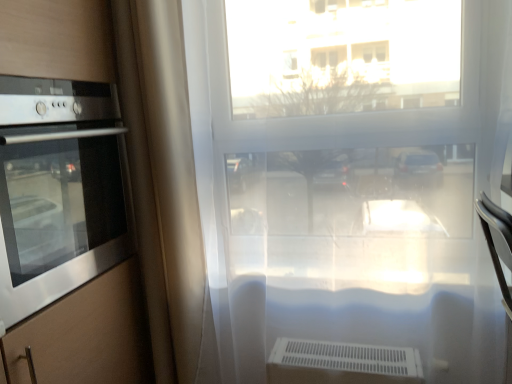
Question: Is stainless steel oven at left inside or outside of transparent plastic window at center?

Choices:
 (A) outside
 (B) inside

Answer: (A)

Question: Visually, is stainless steel oven at left positioned to the left or to the right of transparent plastic window at center?

Choices:
 (A) left
 (B) right

Answer: (A)

Question: Which object is the farthest from the stainless steel oven at left?

Choices:
 (A) transparent plastic window at center
 (B) beige fabric curtain at left

Answer: (A)

Question: Which object is positioned farthest from the stainless steel oven at left?

Choices:
 (A) beige fabric curtain at left
 (B) transparent plastic window at center

Answer: (B)